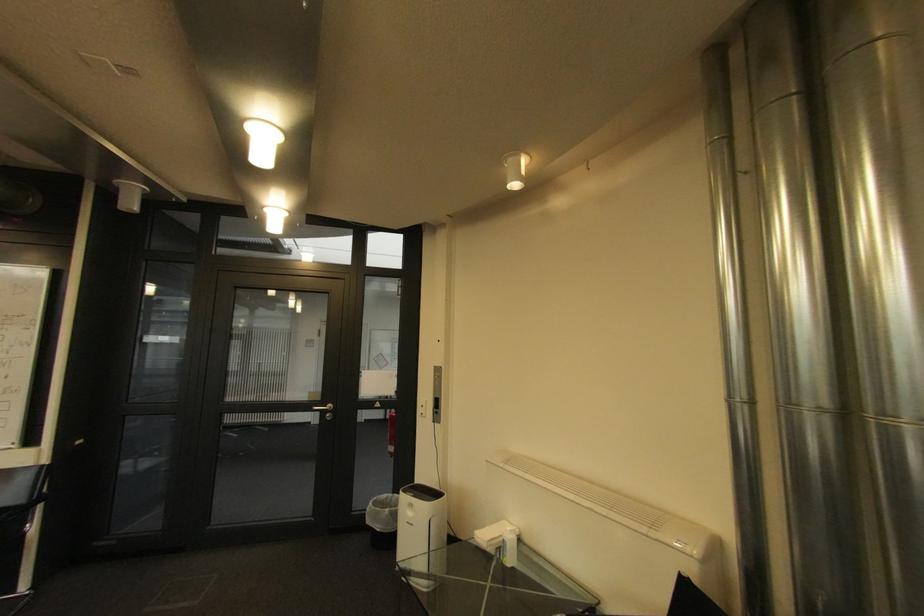
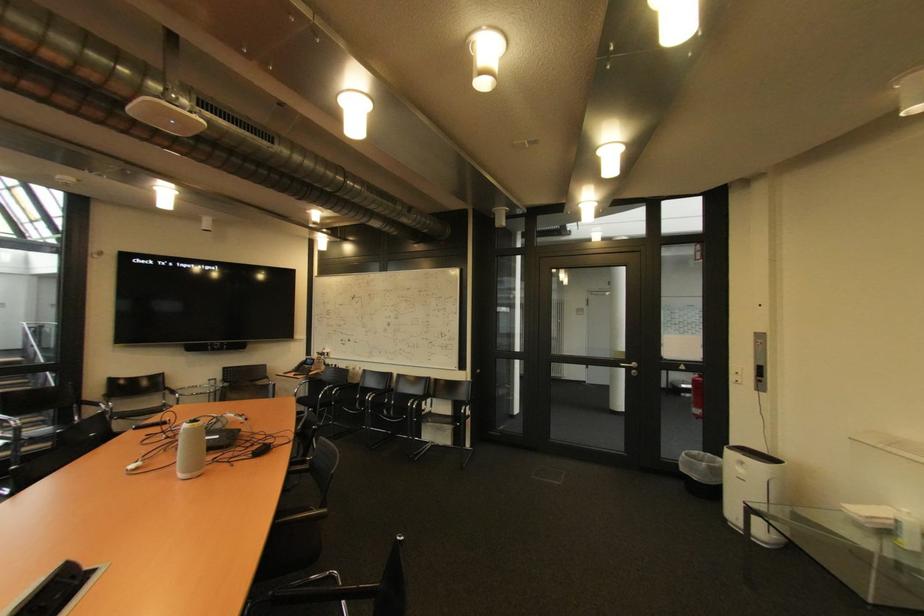
Find the pixel in the second image that matches point 443,368 in the first image.

(763, 334)